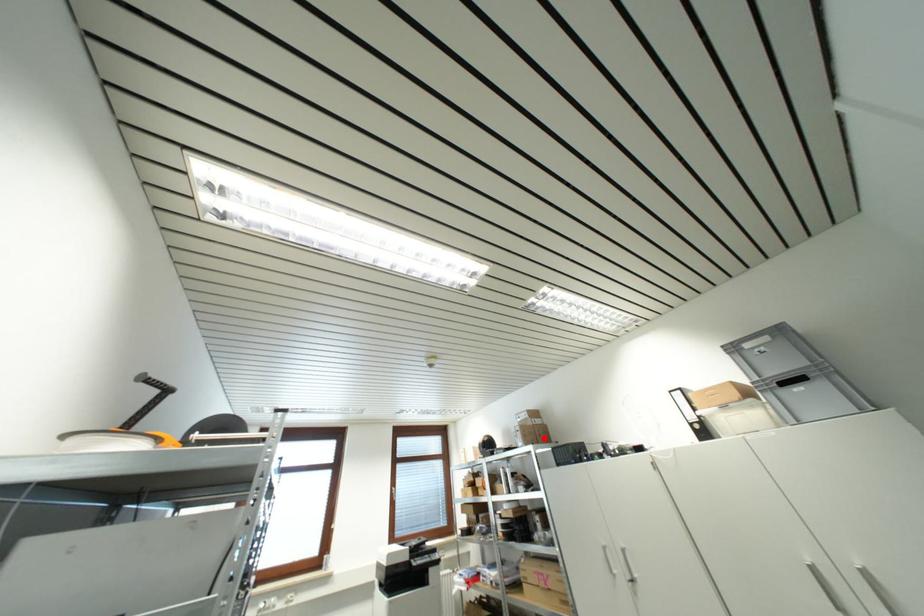
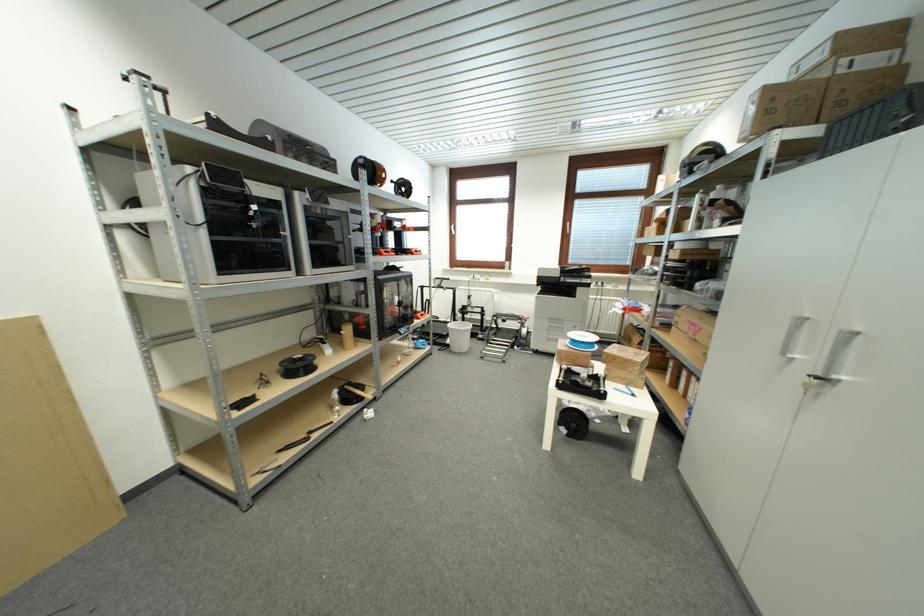
Question: I am providing you with two images of the same scene from different viewpoints. A red point is marked on the first image. Can you still see the location of the red point in image 2?

Choices:
 (A) Yes
 (B) No

Answer: (A)